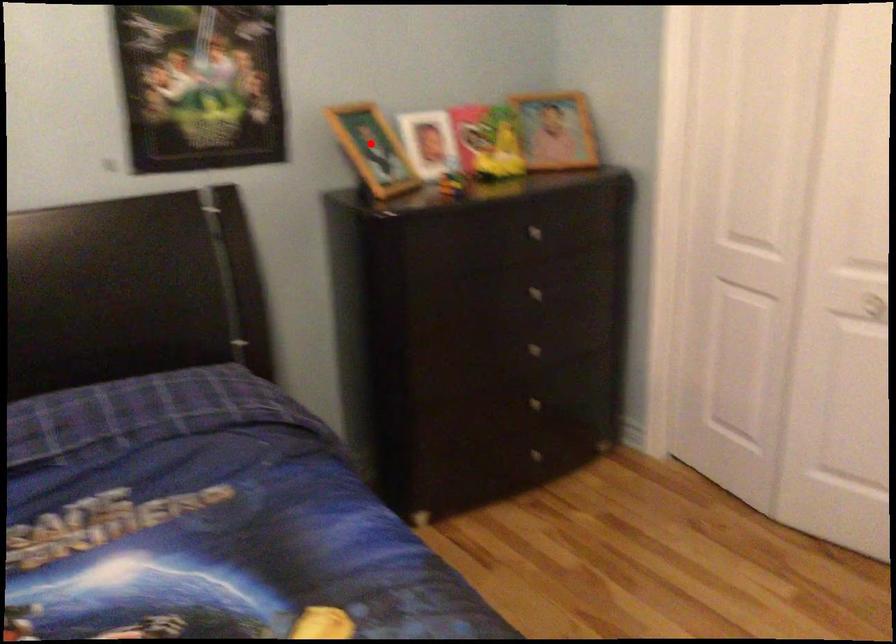
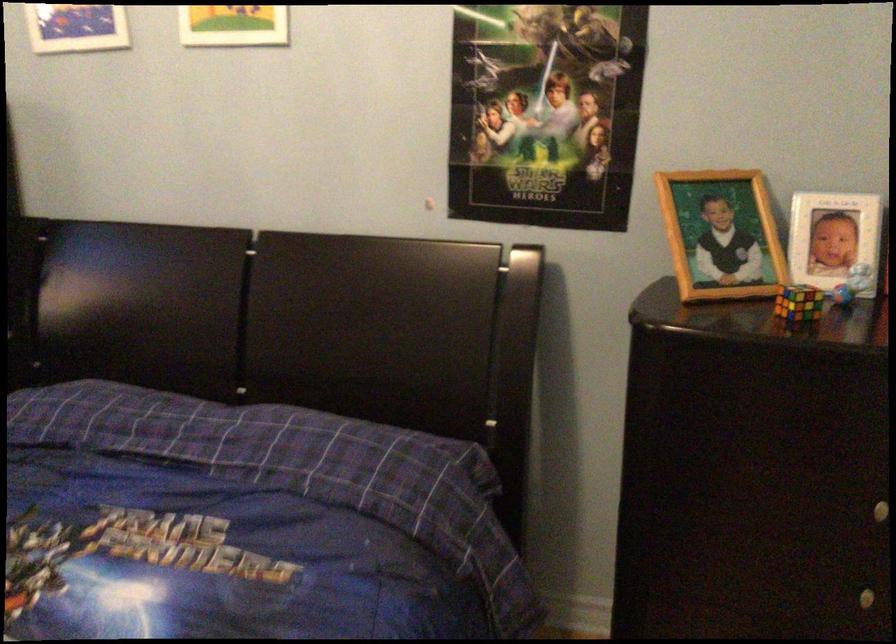
Question: I am providing you with two images of the same scene from different viewpoints. Given a red point in image1, look at the same physical point in image2. Is it:

Choices:
 (A) Closer to the viewpoint
 (B) Farther from the viewpoint

Answer: (A)